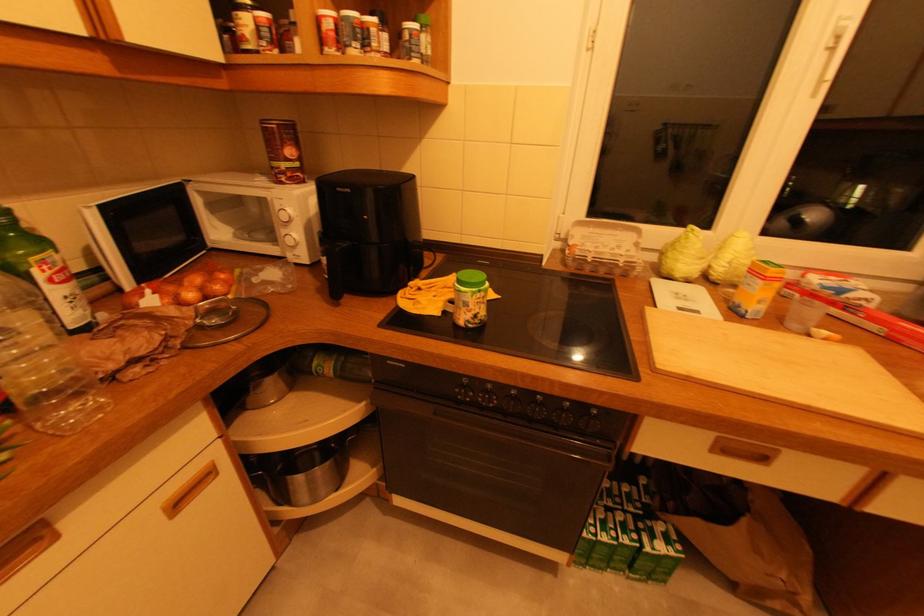
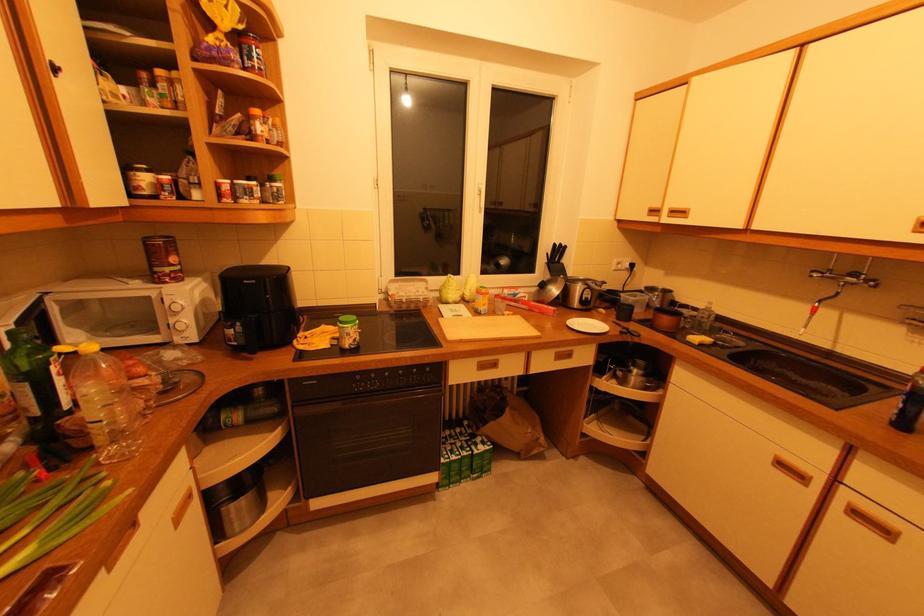
Find the pixel in the second image that matches (139,371) in the first image.

(140, 423)